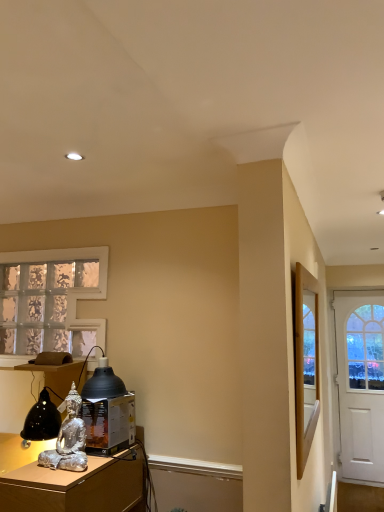
Measure the distance between point (376, 319) and camera.

Point (376, 319) is 4.46 meters from camera.

The width and height of the screenshot is (384, 512). What do you see at coordinates (306, 362) in the screenshot?
I see `wooden framed mirror at right` at bounding box center [306, 362].

What is the approximate height of translucent glass window at left?

The height of translucent glass window at left is 67.18 centimeters.

The image size is (384, 512). I want to click on translucent glass window at left, so click(51, 300).

Based on the photo, in order to face matte black lampshade at lower left, should I rotate leftwards or rightwards?

Turn left by 11.825 degrees to look at matte black lampshade at lower left.

Find the location of `silver metallic statue at lower left`. silver metallic statue at lower left is located at coordinates (68, 438).

Consider the image. In order to face silver metallic statue at lower left, should I rotate leftwards or rightwards?

Rotate left and turn 21.712 degrees.

Identify the location of white matte door at right. This screenshot has height=512, width=384. (360, 383).

What are the coordinates of `person above the silver metallic statue at lower left (from a real-world perspective)` in the screenshot? It's located at (68, 438).

Is silver metallic statue at lower left next to silver metallic statue at lower left and touching it?

No, silver metallic statue at lower left is not next to silver metallic statue at lower left.

From a real-world perspective, between silver metallic statue at lower left and silver metallic statue at lower left, who is vertically higher?

From a 3D spatial view, silver metallic statue at lower left is above.

Is silver metallic statue at lower left thinner than silver metallic statue at lower left?

Correct, the width of silver metallic statue at lower left is less than that of silver metallic statue at lower left.

Considering the relative positions of translucent glass window at left and silver metallic statue at lower left in the image provided, is translucent glass window at left to the left of silver metallic statue at lower left from the viewer's perspective?

Correct, you'll find translucent glass window at left to the left of silver metallic statue at lower left.

Does point (32, 276) appear closer or farther from the camera than point (64, 496)?

Point (32, 276) is positioned farther from the camera compared to point (64, 496).

Considering the sizes of translucent glass window at left and silver metallic statue at lower left in the image, is translucent glass window at left taller or shorter than silver metallic statue at lower left?

Considering their sizes, translucent glass window at left has more height than silver metallic statue at lower left.

Is the depth of silver metallic statue at lower left greater than that of matte black lampshade at lower left?

No, the depth of silver metallic statue at lower left is less than that of matte black lampshade at lower left.

From the image's perspective, between silver metallic statue at lower left and matte black lampshade at lower left, who is located below?

silver metallic statue at lower left.

Considering the relative positions of silver metallic statue at lower left and matte black lampshade at lower left in the image provided, is silver metallic statue at lower left to the right of matte black lampshade at lower left from the viewer's perspective?

In fact, silver metallic statue at lower left is to the left of matte black lampshade at lower left.

Is silver metallic statue at lower left aimed at matte black lampshade at lower left?

No, silver metallic statue at lower left is not oriented towards matte black lampshade at lower left.

Considering the positions of objects silver metallic statue at lower left and translucent glass window at left in the image provided, who is behind, silver metallic statue at lower left or translucent glass window at left?

translucent glass window at left is further away from the camera.

From the image's perspective, is silver metallic statue at lower left located above translucent glass window at left?

No, from the image's perspective, silver metallic statue at lower left is not on top of translucent glass window at left.

Between silver metallic statue at lower left and translucent glass window at left, which one has more height?

With more height is translucent glass window at left.

Looking at this image, does silver metallic statue at lower left turn towards translucent glass window at left?

No, silver metallic statue at lower left is not oriented towards translucent glass window at left.

Is white matte door at right not near translucent glass window at left?

Yes, white matte door at right and translucent glass window at left are quite far apart.

Based on the photo, how many degrees apart are the facing directions of white matte door at right and translucent glass window at left?

The angle between the facing direction of white matte door at right and the facing direction of translucent glass window at left is 0.0945 degrees.

Is white matte door at right facing away from translucent glass window at left?

No, white matte door at right's orientation is not away from translucent glass window at left.

Which is more to the left, white matte door at right or translucent glass window at left?

Positioned to the left is translucent glass window at left.

Between matte black lampshade at lower left and wooden framed mirror at right, which one is positioned behind?

matte black lampshade at lower left is further away from the camera.

Is point (95, 370) more distant than point (300, 398)?

Yes, it is.

From a real-world perspective, relative to wooden framed mirror at right, is matte black lampshade at lower left vertically above or below?

matte black lampshade at lower left is situated lower than wooden framed mirror at right in the real world.

Is matte black lampshade at lower left at the left side of wooden framed mirror at right?

Yes, matte black lampshade at lower left is to the left of wooden framed mirror at right.

Can you confirm if matte black lampshade at lower left is positioned to the right of white matte door at right?

No, matte black lampshade at lower left is not to the right of white matte door at right.

Considering the points (96, 379) and (370, 315), which point is behind, point (96, 379) or point (370, 315)?

Point (370, 315)

From the image's perspective, does matte black lampshade at lower left appear lower than white matte door at right?

Incorrect, from the image's perspective, matte black lampshade at lower left is higher than white matte door at right.

Which is behind, matte black lampshade at lower left or white matte door at right?

white matte door at right.

In the image, there is a silver metallic statue at lower left. What are the coordinates of `person above it (from the image's perspective)` in the screenshot? It's located at coord(68,438).

At what (x,y) coordinates should I click in order to perform the action: click on window behind the silver metallic statue at lower left. Please return your answer as a coordinate pair (x, y). This screenshot has width=384, height=512. Looking at the image, I should click on (51, 300).

When comparing their distances from wooden framed mirror at right, does white matte door at right or matte black lampshade at lower left seem further?

white matte door at right lies further to wooden framed mirror at right than the other object.

Looking at the image, which one is located closer to matte black lampshade at lower left, white matte door at right or silver metallic statue at lower left?

silver metallic statue at lower left is positioned closer to the anchor matte black lampshade at lower left.

When comparing their distances from white matte door at right, does translucent glass window at left or silver metallic statue at lower left seem closer?

silver metallic statue at lower left.

Looking at the image, which one is located further to wooden framed mirror at right, matte black lampshade at lower left or silver metallic statue at lower left?

matte black lampshade at lower left is further to wooden framed mirror at right.

Which object lies nearer to the anchor point silver metallic statue at lower left, translucent glass window at left or white matte door at right?

translucent glass window at left lies closer to silver metallic statue at lower left than the other object.

Estimate the real-world distances between objects in this image. Which object is further from matte black lampshade at lower left, silver metallic statue at lower left or translucent glass window at left?

translucent glass window at left is positioned further to the anchor matte black lampshade at lower left.

Based on their spatial positions, is silver metallic statue at lower left or translucent glass window at left closer to wooden framed mirror at right?

silver metallic statue at lower left is closer to wooden framed mirror at right.

Looking at the image, which one is located closer to white matte door at right, wooden framed mirror at right or matte black lampshade at lower left?

wooden framed mirror at right lies closer to white matte door at right than the other object.

This screenshot has width=384, height=512. I want to click on table lamp positioned between silver metallic statue at lower left and white matte door at right from near to far, so click(x=102, y=381).

At what (x,y) coordinates should I click in order to perform the action: click on person between silver metallic statue at lower left and white matte door at right from front to back. Please return your answer as a coordinate pair (x, y). This screenshot has height=512, width=384. Looking at the image, I should click on (68, 438).

Locate an element on the screen. table lamp between silver metallic statue at lower left and wooden framed mirror at right in the horizontal direction is located at coordinates 102,381.

Where is `desk situated between translucent glass window at left and white matte door at right from left to right`? This screenshot has height=512, width=384. desk situated between translucent glass window at left and white matte door at right from left to right is located at coordinates (74, 487).